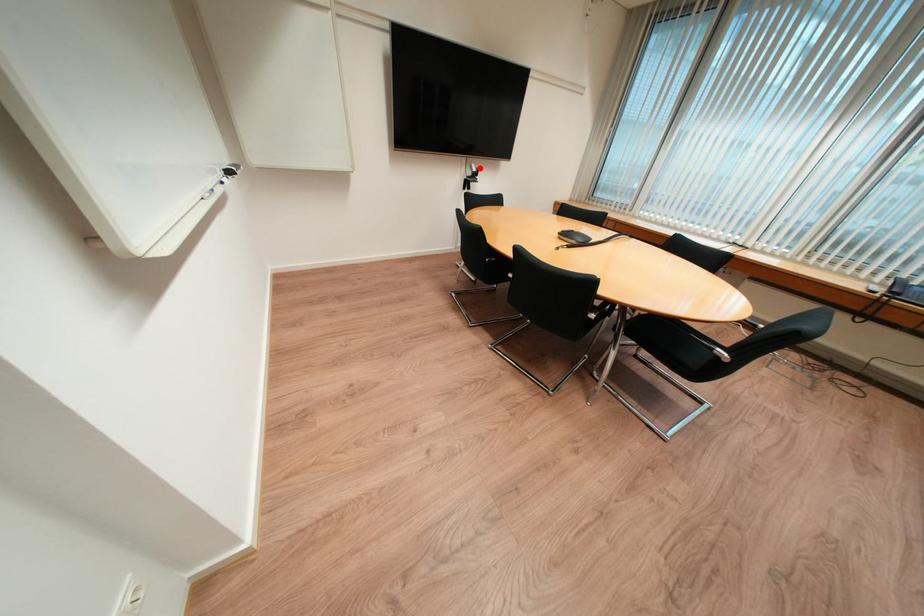
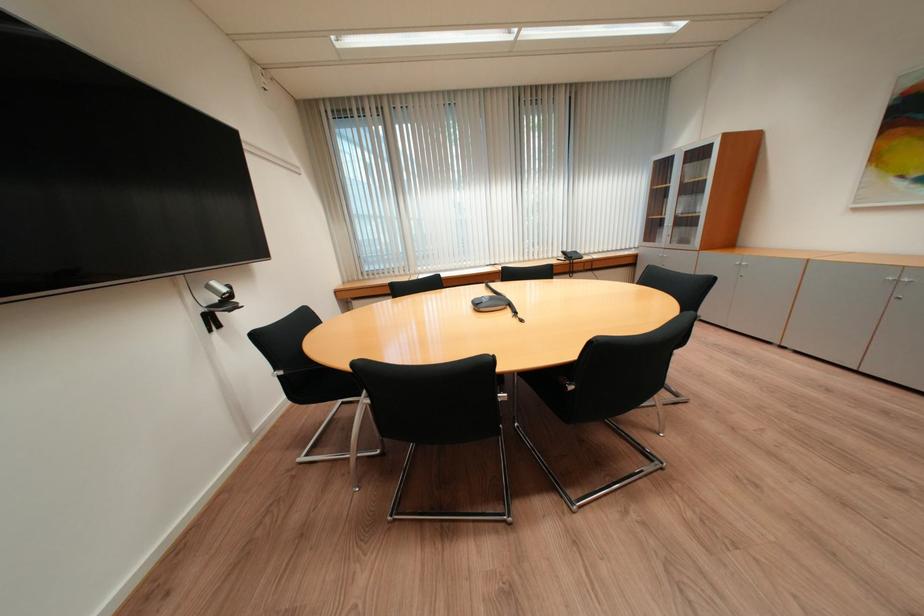
In the second image, find the point that corresponds to the highlighted location in the first image.

(217, 289)